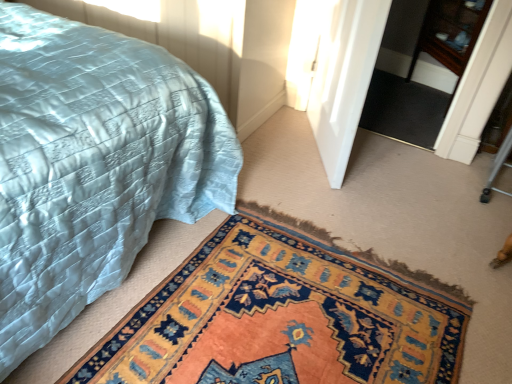
Locate an element on the screen. Image resolution: width=512 pixels, height=384 pixels. free location to the left of wooden dresser at upper right is located at coordinates (376, 99).